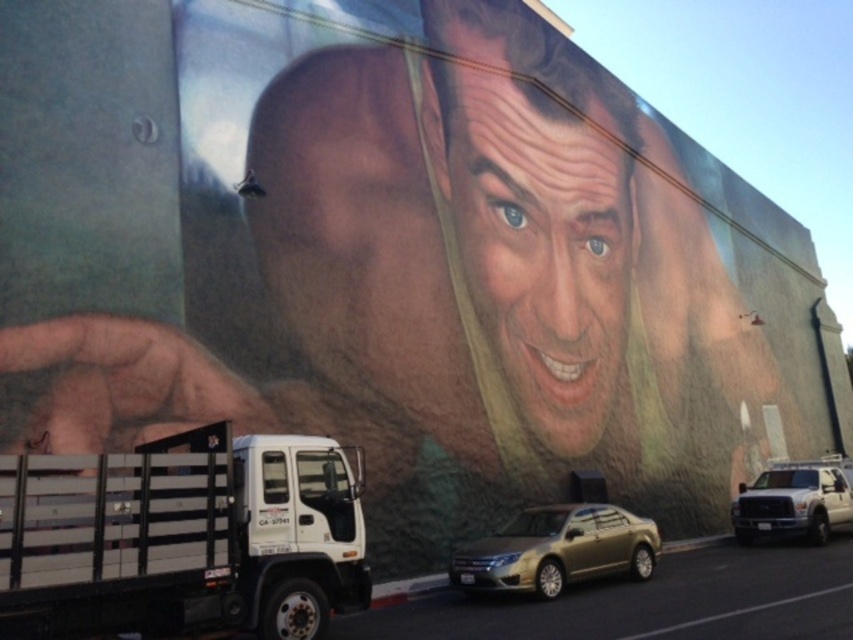
Question: Can you confirm if white matte truck at lower left is bigger than white matte truck at lower right?

Choices:
 (A) no
 (B) yes

Answer: (B)

Question: Among these objects, which one is nearest to the camera?

Choices:
 (A) smooth skin face at center
 (B) gold metallic sedan at center
 (C) white matte truck at lower left

Answer: (C)

Question: Considering the relative positions of smooth skin face at center and gold metallic sedan at center in the image provided, where is smooth skin face at center located with respect to gold metallic sedan at center?

Choices:
 (A) above
 (B) below

Answer: (A)

Question: Based on their relative distances, which object is nearer to the white matte truck at lower left?

Choices:
 (A) white matte truck at lower right
 (B) gold metallic sedan at center

Answer: (B)

Question: Which point is farther to the camera?

Choices:
 (A) (157, 461)
 (B) (532, 358)

Answer: (B)

Question: From the image, what is the correct spatial relationship of smooth skin face at center in relation to gold metallic sedan at center?

Choices:
 (A) right
 (B) left

Answer: (A)